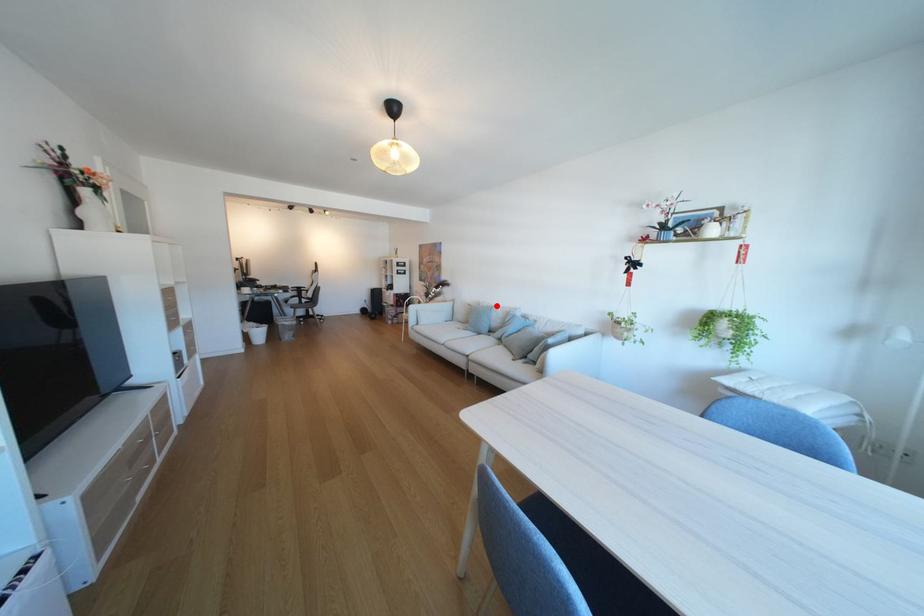
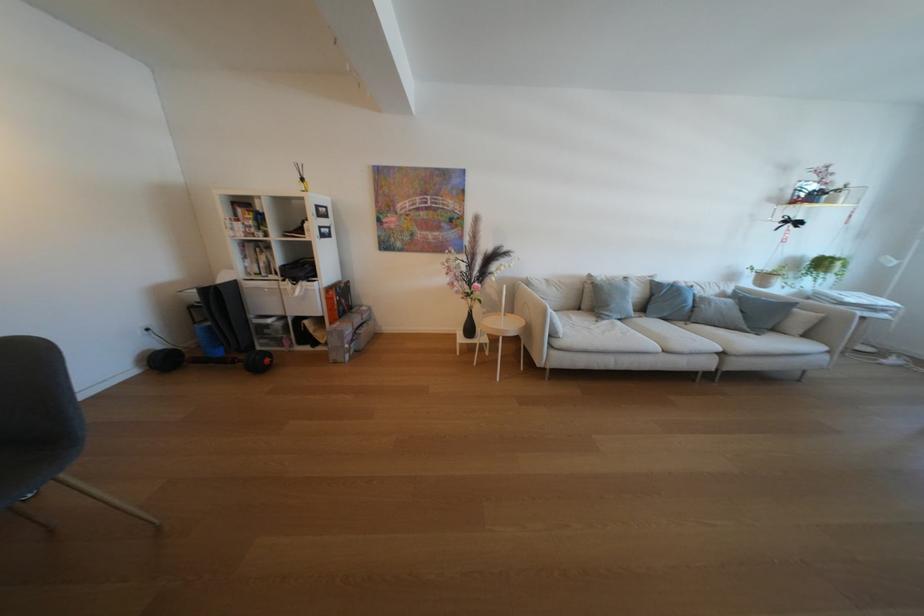
Find the pixel in the second image that matches the highlighted location in the first image.

(614, 278)